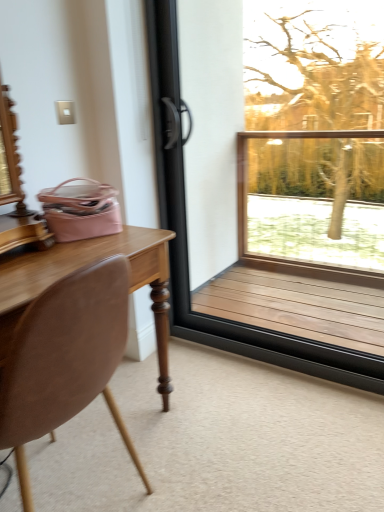
Question: Does brown leather chair at left have a smaller size compared to brown wooden window at right?

Choices:
 (A) yes
 (B) no

Answer: (B)

Question: Is brown leather chair at left closer to camera compared to brown wooden window at right?

Choices:
 (A) no
 (B) yes

Answer: (B)

Question: Would you say brown wooden window at right is part of brown leather chair at left's contents?

Choices:
 (A) no
 (B) yes

Answer: (A)

Question: From a real-world perspective, is brown leather chair at left physically above brown wooden window at right?

Choices:
 (A) yes
 (B) no

Answer: (B)

Question: Is there a large distance between brown leather chair at left and brown wooden window at right?

Choices:
 (A) no
 (B) yes

Answer: (B)

Question: Can you confirm if brown leather chair at left is thinner than brown wooden window at right?

Choices:
 (A) yes
 (B) no

Answer: (B)

Question: Is brown wooden window at right closer to the viewer compared to brown leather chair at left?

Choices:
 (A) yes
 (B) no

Answer: (B)

Question: Can you confirm if brown wooden window at right is wider than brown leather chair at left?

Choices:
 (A) no
 (B) yes

Answer: (A)

Question: From the image's perspective, does brown wooden window at right appear higher than brown leather chair at left?

Choices:
 (A) yes
 (B) no

Answer: (A)

Question: Can you confirm if brown wooden window at right is positioned to the left of brown leather chair at left?

Choices:
 (A) no
 (B) yes

Answer: (A)

Question: Considering the relative sizes of brown wooden window at right and brown leather chair at left in the image provided, is brown wooden window at right smaller than brown leather chair at left?

Choices:
 (A) yes
 (B) no

Answer: (A)

Question: Can you confirm if brown wooden window at right is shorter than brown leather chair at left?

Choices:
 (A) no
 (B) yes

Answer: (A)

Question: In terms of height, does brown wooden window at right look taller or shorter compared to brown leather chair at left?

Choices:
 (A) short
 (B) tall

Answer: (B)